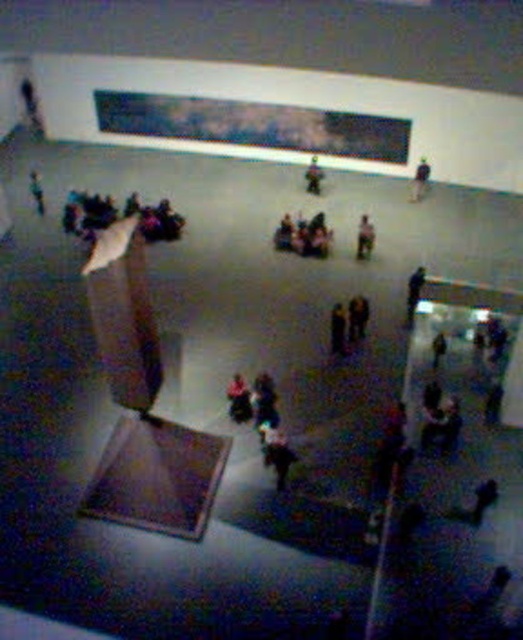
You are an interior designer planning to place a rectangular rug in the center of the room. The rug must accommodate both the dark blue jeans at center and the dark brown leather jacket at center without overlapping them. Given their positions and sizes, will the rug need to be wider to the left or the right side to ensure both items are fully on the rug?

The dark blue jeans at center is wider than the dark brown leather jacket at center. Therefore, the rug needs to be wider on the left side to accommodate the wider dark blue jeans at center and ensure both items are fully covered without overlapping.

You are an artist planning to hang a new artwork between the dark gray fabric jacket at upper right and the dark gray fabric jacket at center. Based on their widths, which jacket should you consider placing closer to the wall to ensure the artwork fits properly?

The dark gray fabric jacket at upper right might be wider than the dark gray fabric jacket at center, so placing the wider jacket closer to the wall would allow the artwork to fit between them more appropriately.

You are standing in the center of the museum and want to place a small decorative item on the dark blue jeans at center. Given that the museum requires all items to be placed within a 1 meter radius from your current position, can you place the item there?

The dark blue jeans at center is located at point coordinates which are within the 1 meter radius from your current position, so yes, you can place the item there.